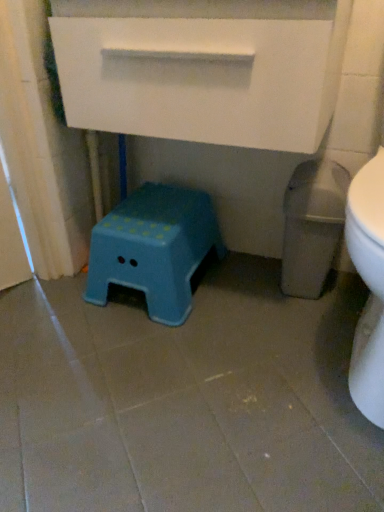
Question: Does blue plastic stool at lower left have a lesser height compared to white matte drawer at upper center?

Choices:
 (A) yes
 (B) no

Answer: (A)

Question: From a real-world perspective, is blue plastic stool at lower left physically above white matte drawer at upper center?

Choices:
 (A) no
 (B) yes

Answer: (A)

Question: From a real-world perspective, is blue plastic stool at lower left physically below white matte drawer at upper center?

Choices:
 (A) no
 (B) yes

Answer: (B)

Question: Considering the relative positions of blue plastic stool at lower left and white matte drawer at upper center in the image provided, is blue plastic stool at lower left in front of white matte drawer at upper center?

Choices:
 (A) no
 (B) yes

Answer: (A)

Question: Does blue plastic stool at lower left have a larger size compared to white matte drawer at upper center?

Choices:
 (A) yes
 (B) no

Answer: (B)

Question: Considering the relative positions of blue plastic stool at lower left and white matte drawer at upper center in the image provided, is blue plastic stool at lower left behind white matte drawer at upper center?

Choices:
 (A) yes
 (B) no

Answer: (A)

Question: Would you say white matte drawer at upper center is outside blue plastic stool at lower left?

Choices:
 (A) no
 (B) yes

Answer: (B)

Question: From the image's perspective, is white matte drawer at upper center located beneath blue plastic stool at lower left?

Choices:
 (A) yes
 (B) no

Answer: (B)

Question: Is white matte drawer at upper center with blue plastic stool at lower left?

Choices:
 (A) no
 (B) yes

Answer: (A)

Question: Does white matte drawer at upper center have a lesser height compared to blue plastic stool at lower left?

Choices:
 (A) no
 (B) yes

Answer: (A)

Question: Considering the relative sizes of white matte drawer at upper center and blue plastic stool at lower left in the image provided, is white matte drawer at upper center thinner than blue plastic stool at lower left?

Choices:
 (A) no
 (B) yes

Answer: (A)

Question: From a real-world perspective, is white matte drawer at upper center over blue plastic stool at lower left?

Choices:
 (A) yes
 (B) no

Answer: (A)

Question: In terms of height, does blue plastic stool at lower left look taller or shorter compared to white matte drawer at upper center?

Choices:
 (A) tall
 (B) short

Answer: (B)